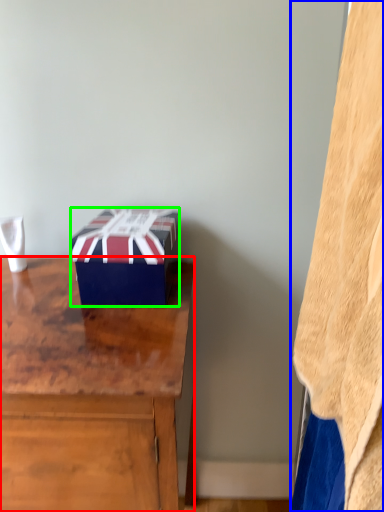
Question: Which object is positioned farthest from desk (highlighted by a red box)? Select from blanket (highlighted by a blue box) and box (highlighted by a green box).

Choices:
 (A) blanket
 (B) box

Answer: (A)